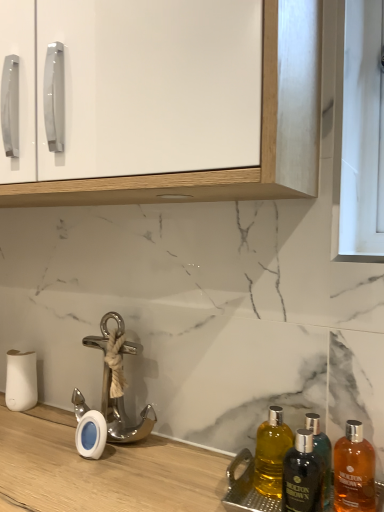
Question: From a real-world perspective, is shiny amber glass bottle at lower right, the 1th bottle in the right-to-left sequence, below dark brown glass bottle at lower right, the second bottle when ordered from left to right?

Choices:
 (A) yes
 (B) no

Answer: (A)

Question: From the image's perspective, would you say shiny amber glass bottle at lower right, the 1th bottle in the right-to-left sequence, is shown under dark brown glass bottle at lower right, which is the 2th bottle from right to left?

Choices:
 (A) no
 (B) yes

Answer: (B)

Question: Is shiny amber glass bottle at lower right, the 1th bottle in the right-to-left sequence, directly adjacent to dark brown glass bottle at lower right, which is the 2th bottle from right to left?

Choices:
 (A) no
 (B) yes

Answer: (B)

Question: Is shiny amber glass bottle at lower right, the 1th bottle in the right-to-left sequence, oriented away from dark brown glass bottle at lower right, the second bottle when ordered from left to right?

Choices:
 (A) no
 (B) yes

Answer: (A)

Question: Can you confirm if shiny amber glass bottle at lower right, the third bottle when ordered from left to right, is wider than dark brown glass bottle at lower right, which is the 2th bottle from right to left?

Choices:
 (A) no
 (B) yes

Answer: (B)

Question: Is shiny amber glass bottle at lower right, the third bottle when ordered from left to right, taller than dark brown glass bottle at lower right, which is the 2th bottle from right to left?

Choices:
 (A) no
 (B) yes

Answer: (B)

Question: Considering the relative sizes of shiny amber glass bottle at lower right, the 1th bottle in the right-to-left sequence, and yellow glass bottle at lower right, the 3th bottle in the right-to-left sequence, in the image provided, is shiny amber glass bottle at lower right, the 1th bottle in the right-to-left sequence, bigger than yellow glass bottle at lower right, the 3th bottle in the right-to-left sequence,?

Choices:
 (A) no
 (B) yes

Answer: (B)

Question: From the image's perspective, is shiny amber glass bottle at lower right, the third bottle when ordered from left to right, above yellow glass bottle at lower right, the 3th bottle in the right-to-left sequence?

Choices:
 (A) yes
 (B) no

Answer: (B)

Question: From a real-world perspective, is shiny amber glass bottle at lower right, the 1th bottle in the right-to-left sequence, located higher than yellow glass bottle at lower right, which appears as the 1th bottle when viewed from the left?

Choices:
 (A) no
 (B) yes

Answer: (A)

Question: From the image's perspective, would you say shiny amber glass bottle at lower right, the 1th bottle in the right-to-left sequence, is shown under yellow glass bottle at lower right, which appears as the 1th bottle when viewed from the left?

Choices:
 (A) yes
 (B) no

Answer: (A)

Question: Is shiny amber glass bottle at lower right, the 1th bottle in the right-to-left sequence, beside yellow glass bottle at lower right, which appears as the 1th bottle when viewed from the left?

Choices:
 (A) no
 (B) yes

Answer: (A)

Question: Could you tell me if shiny amber glass bottle at lower right, the 1th bottle in the right-to-left sequence, is turned towards yellow glass bottle at lower right, the 3th bottle in the right-to-left sequence?

Choices:
 (A) no
 (B) yes

Answer: (A)

Question: Is shiny amber glass bottle at lower right, the 1th bottle in the right-to-left sequence, a part of polished silver anchor at lower left?

Choices:
 (A) no
 (B) yes

Answer: (A)